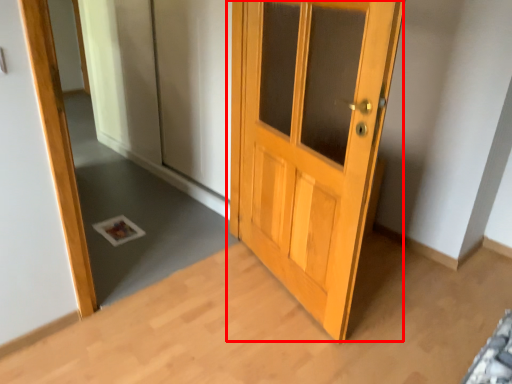
Question: In this image, where is door (annotated by the red box) located relative to mirror?

Choices:
 (A) right
 (B) left

Answer: (A)